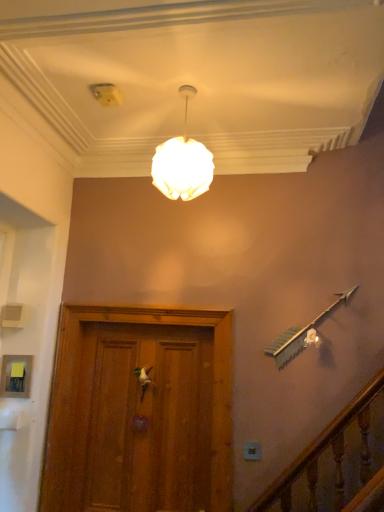
Question: Is white matte sphere at upper center inside white plastic electric outlet at lower center?

Choices:
 (A) no
 (B) yes

Answer: (A)

Question: Is white plastic electric outlet at lower center outside of white matte sphere at upper center?

Choices:
 (A) no
 (B) yes

Answer: (B)

Question: Is white plastic electric outlet at lower center looking in the opposite direction of white matte sphere at upper center?

Choices:
 (A) no
 (B) yes

Answer: (A)

Question: Does white plastic electric outlet at lower center have a smaller size compared to white matte sphere at upper center?

Choices:
 (A) yes
 (B) no

Answer: (A)

Question: Is white plastic electric outlet at lower center in front of white matte sphere at upper center?

Choices:
 (A) yes
 (B) no

Answer: (B)

Question: Considering the relative sizes of white plastic electric outlet at lower center and white matte sphere at upper center in the image provided, is white plastic electric outlet at lower center shorter than white matte sphere at upper center?

Choices:
 (A) yes
 (B) no

Answer: (A)

Question: Can you confirm if white matte sphere at upper center is taller than white plastic electric outlet at lower center?

Choices:
 (A) yes
 (B) no

Answer: (A)

Question: Is white matte sphere at upper center smaller than white plastic electric outlet at lower center?

Choices:
 (A) no
 (B) yes

Answer: (A)

Question: Does white matte sphere at upper center lie behind white plastic electric outlet at lower center?

Choices:
 (A) yes
 (B) no

Answer: (B)

Question: From the image's perspective, is white matte sphere at upper center beneath white plastic electric outlet at lower center?

Choices:
 (A) no
 (B) yes

Answer: (A)

Question: From a real-world perspective, is white matte sphere at upper center on white plastic electric outlet at lower center?

Choices:
 (A) no
 (B) yes

Answer: (B)

Question: Is white matte sphere at upper center facing towards white plastic electric outlet at lower center?

Choices:
 (A) no
 (B) yes

Answer: (A)

Question: From the image's perspective, is white matte door handle at center on top of white plastic electric outlet at lower center?

Choices:
 (A) no
 (B) yes

Answer: (B)